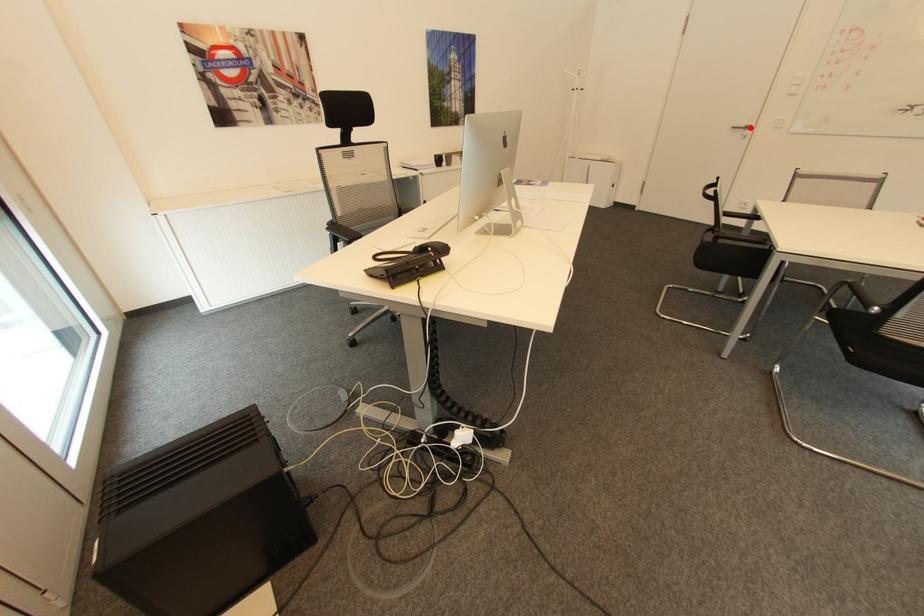
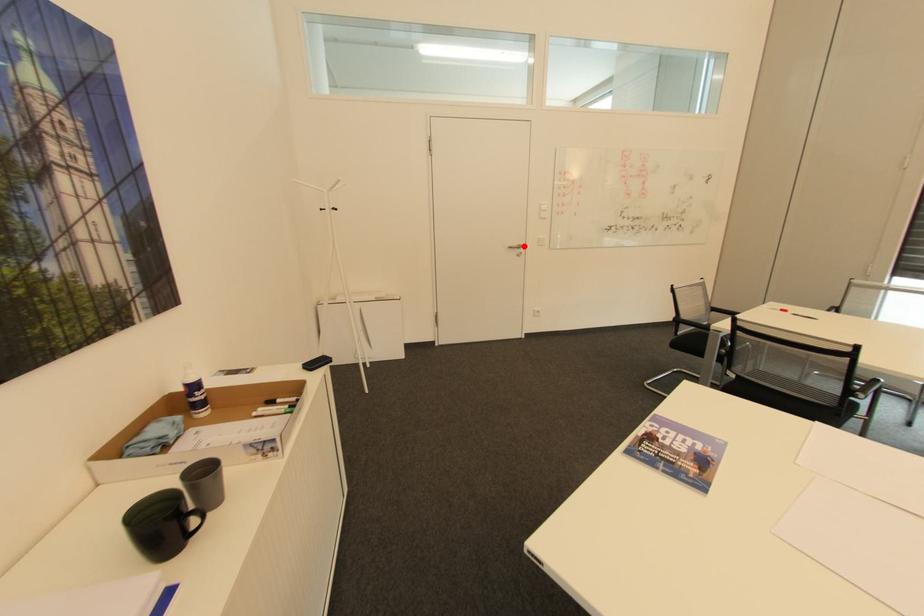
I am providing you with two images of the same scene from different viewpoints. A red point is marked on the first image and another point is marked on the second image. Is the red point in image1 aligned with the point shown in image2?

Yes